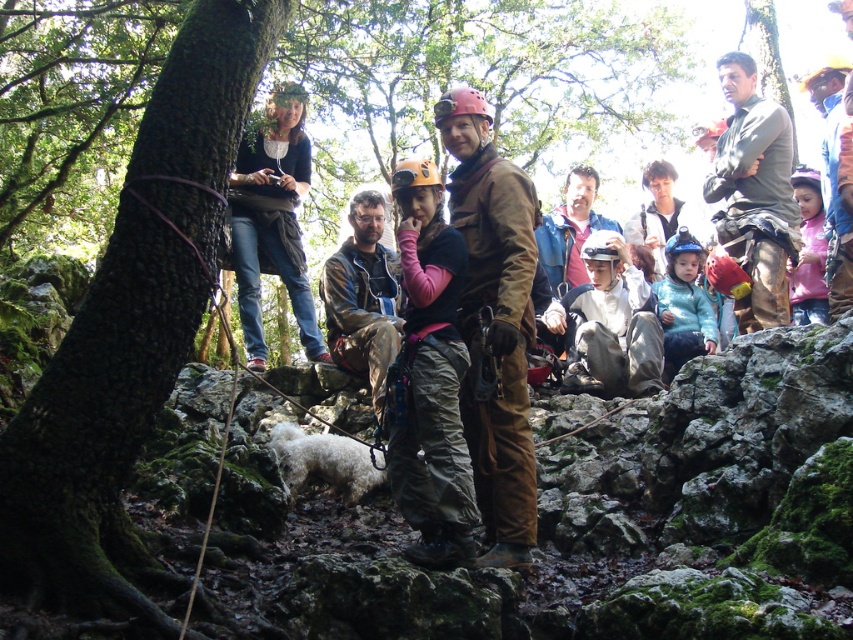
You are a photographer positioned at the center of the scene. You want to take a photo that includes both the camouflage pants at center and the white fluffy dog at center. Which object will appear closer to the camera in the photo?

The camouflage pants at center will appear closer to the camera in the photo because it is further to the viewer than the white fluffy dog at center.

You are a photographer positioned at the center of the scene. You need to take a photo that includes both the brown suede jacket at center and the denim jeans at upper left. Which object should you adjust your camera angle to focus on first to ensure both are in frame?

The brown suede jacket at center is in front of denim jeans at upper left, so you should focus on the brown suede jacket at center first to ensure it doesn not block the denim jeans at upper left in the photo.

You are a photographer trying to capture a candid shot of the group without moving anyone. You notice the brown suede jacket at center and the denim jeans at upper left. Which object should you adjust your camera angle towards to focus on the one that is positioned to the left?

The denim jeans at upper left are positioned to the left of the brown suede jacket at center, so you should adjust your camera angle towards the denim jeans at upper left to focus on the leftmost object.